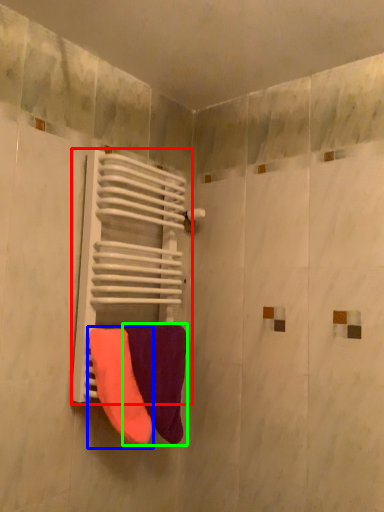
Question: Based on their relative distances, which object is nearer to radiator (highlighted by a red box)? Choose from towel (highlighted by a blue box) and towel (highlighted by a green box).

Choices:
 (A) towel
 (B) towel

Answer: (B)